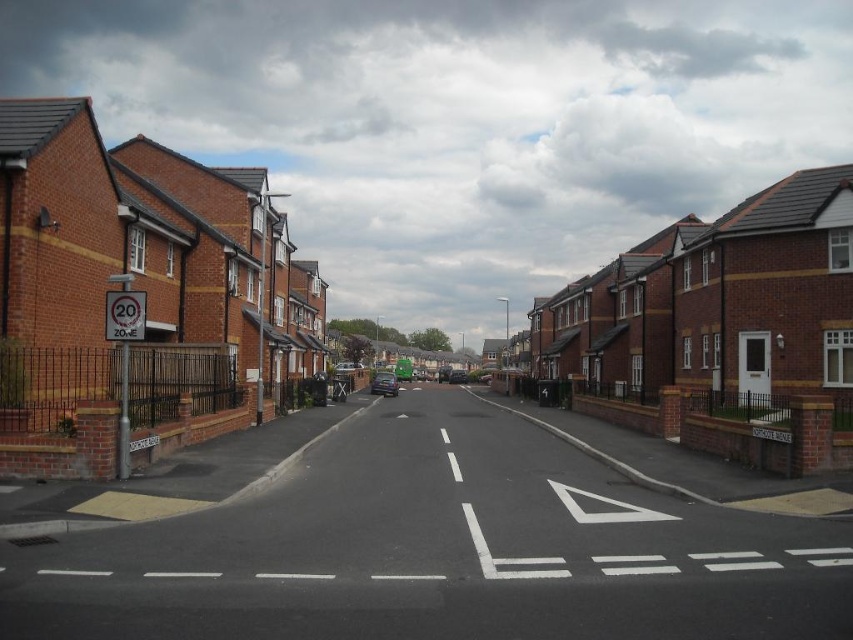
Question: Can you confirm if metallic blue car at center is thinner than shiny black car at center?

Choices:
 (A) no
 (B) yes

Answer: (A)

Question: Is metallic blue car at center closer to camera compared to shiny black car at center?

Choices:
 (A) yes
 (B) no

Answer: (A)

Question: Among these points, which one is nearest to the camera?

Choices:
 (A) (380, 380)
 (B) (456, 381)

Answer: (A)

Question: Does metallic blue car at center have a lesser width compared to shiny black car at center?

Choices:
 (A) yes
 (B) no

Answer: (B)